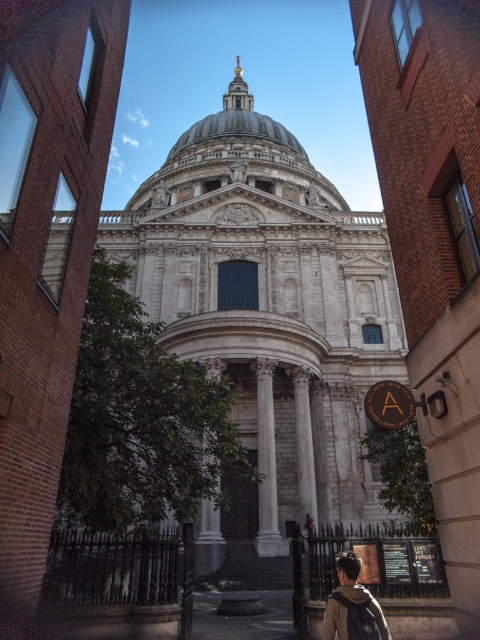
Question: Can you confirm if white marble dome at center is positioned above dark brown leather backpack at lower right?

Choices:
 (A) no
 (B) yes

Answer: (B)

Question: Which of these objects is positioned farthest from the white marble dome at center?

Choices:
 (A) white marble church at center
 (B) dark brown leather backpack at lower right

Answer: (B)

Question: Which point appears closest to the camera in this image?

Choices:
 (A) (263, 124)
 (B) (120, 241)
 (C) (340, 595)

Answer: (C)

Question: Is white marble dome at center smaller than dark brown leather backpack at lower right?

Choices:
 (A) yes
 (B) no

Answer: (B)

Question: Which point appears farthest from the camera in this image?

Choices:
 (A) (385, 320)
 (B) (180, 163)

Answer: (B)

Question: Is the position of white marble church at center more distant than that of dark brown leather backpack at lower right?

Choices:
 (A) yes
 (B) no

Answer: (A)